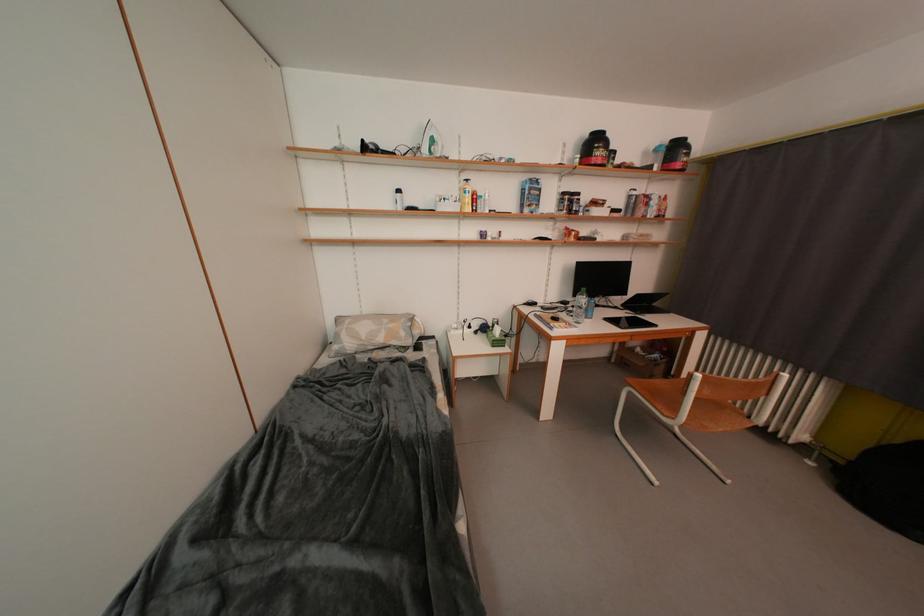
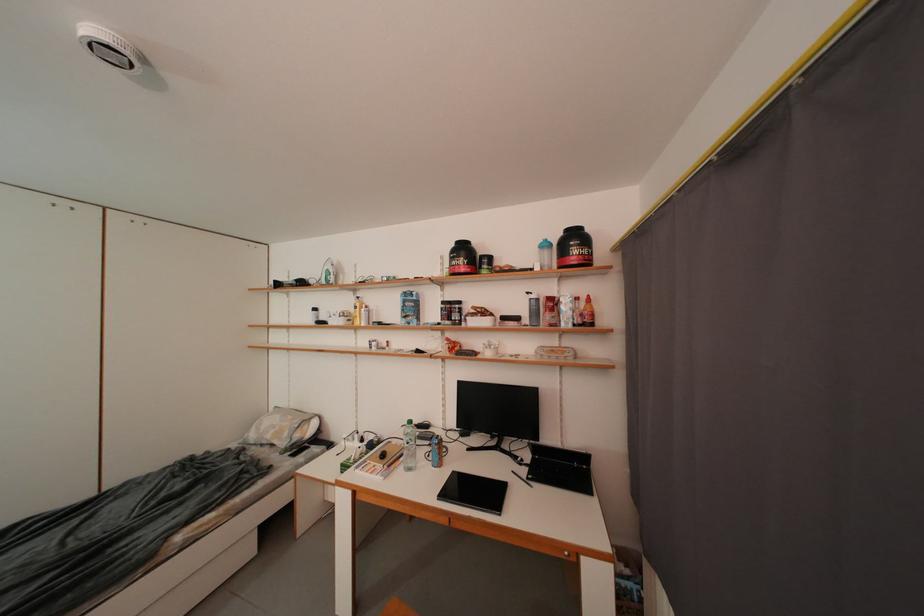
Where in the second image is the point corresponding to point (663, 153) from the first image?

(553, 249)